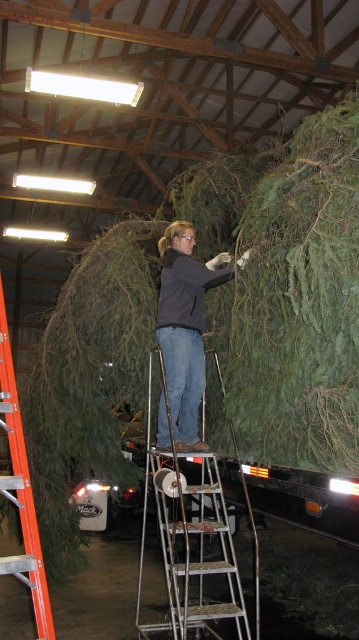
Question: Considering the relative positions of silver metallic ladder at center and orange plastic ladder at left in the image provided, where is silver metallic ladder at center located with respect to orange plastic ladder at left?

Choices:
 (A) left
 (B) right

Answer: (B)

Question: Can you confirm if dark gray sweater at center is positioned above orange plastic ladder at left?

Choices:
 (A) no
 (B) yes

Answer: (B)

Question: Which is farther from the silver metallic ladder at center?

Choices:
 (A) dark gray sweater at center
 (B) orange plastic ladder at left

Answer: (B)

Question: Which object is closer to the camera taking this photo?

Choices:
 (A) orange plastic ladder at left
 (B) dark gray sweater at center

Answer: (A)

Question: Which object appears closest to the camera in this image?

Choices:
 (A) silver metallic ladder at center
 (B) orange plastic ladder at left
 (C) dark gray sweater at center

Answer: (B)

Question: Is silver metallic ladder at center to the left of dark gray sweater at center from the viewer's perspective?

Choices:
 (A) no
 (B) yes

Answer: (B)